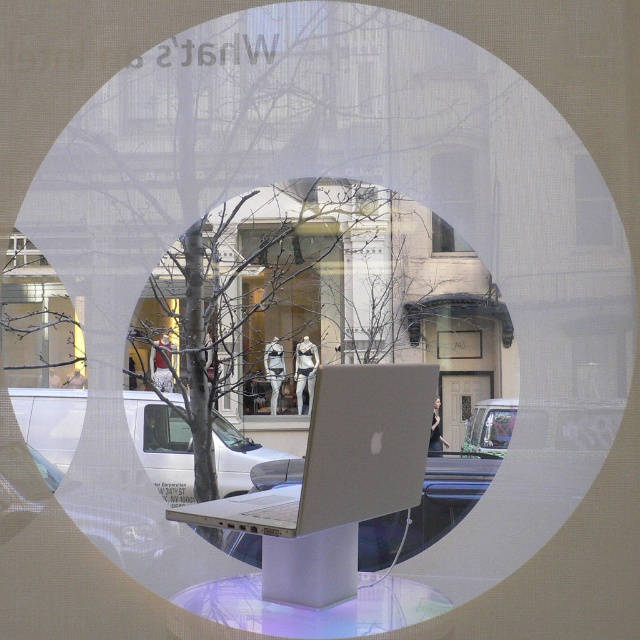
Can you confirm if clear glass window at upper left is positioned to the left of metallic silver car at center?

Correct, you'll find clear glass window at upper left to the left of metallic silver car at center.

Does clear glass window at upper left have a smaller size compared to metallic silver car at center?

Incorrect, clear glass window at upper left is not smaller in size than metallic silver car at center.

Describe the element at coordinates (36, 323) in the screenshot. I see `clear glass window at upper left` at that location.

This screenshot has height=640, width=640. What are the coordinates of `clear glass window at upper left` in the screenshot? It's located at (36, 323).

Is white matte van at center above clear glass window at upper left?

No, white matte van at center is not above clear glass window at upper left.

Find the location of a particular element. white matte van at center is located at coordinates (161, 444).

Identify the location of white matte van at center. (161, 444).

Does point (340, 368) come closer to viewer compared to point (454, 193)?

Yes, it is.

Which is behind, point (426, 410) or point (451, 212)?

Point (451, 212)

Which is in front, point (420, 476) or point (470, 250)?

Point (420, 476)

The width and height of the screenshot is (640, 640). I want to click on silver metallic laptop at center, so click(342, 456).